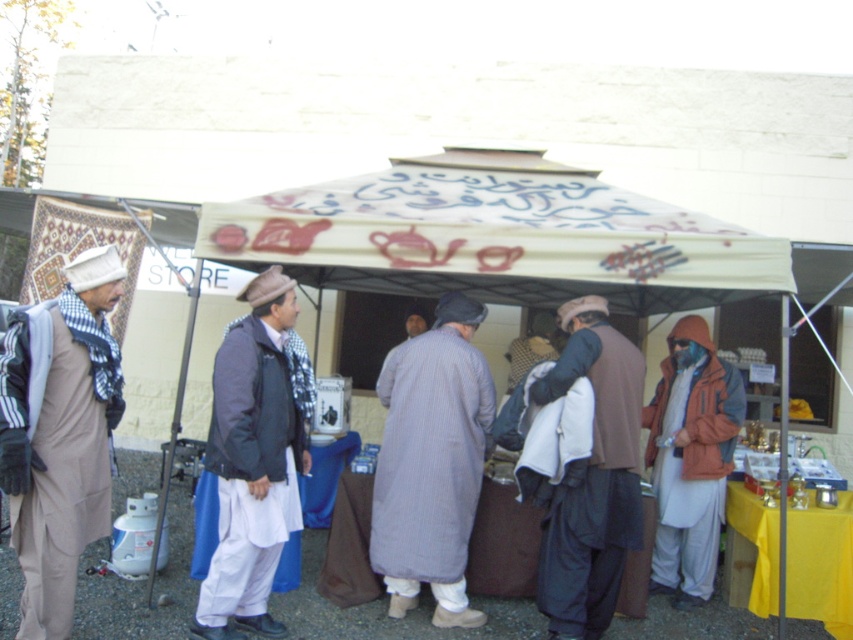
Between point (477, 458) and point (566, 516), which one is positioned in front?

Point (566, 516) is more forward.

Which is above, striped cotton robe at center or dark brown woolen jacket at center?

dark brown woolen jacket at center is higher up.

The height and width of the screenshot is (640, 853). In order to click on striped cotton robe at center in this screenshot , I will do `click(431, 461)`.

Looking at this image, can you confirm if beige canvas tent at center is shorter than dark gray fabric jacket at center?

Yes.

Is point (631, 296) positioned behind point (252, 561)?

Yes, point (631, 296) is farther from viewer.

Identify the location of beige canvas tent at center. (497, 236).

Is beige canvas tent at center taller than blue fabric mask at right?

No.

Which is behind, point (634, 196) or point (712, 481)?

The point (634, 196) is more distant.

Is point (527, 227) in front of point (680, 588)?

That is True.

Where is `beige canvas tent at center`? This screenshot has width=853, height=640. beige canvas tent at center is located at coordinates (497, 236).